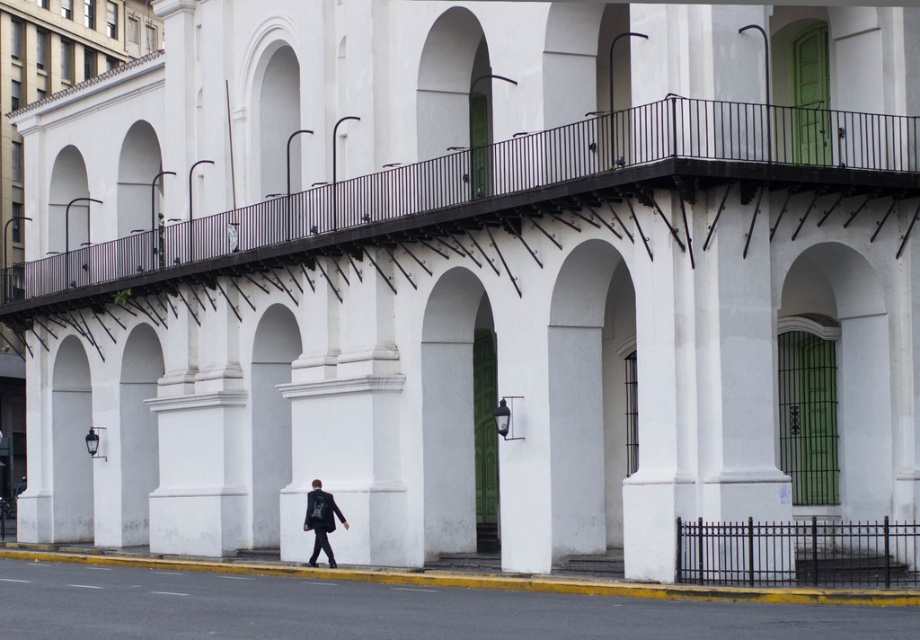
Question: Which of the following is the farthest from the observer?

Choices:
 (A) black metal railing at upper center
 (B) black metal fence at lower right

Answer: (A)

Question: Can you confirm if black metal fence at lower right is positioned above dark gray suit at center?

Choices:
 (A) yes
 (B) no

Answer: (A)

Question: Which of these objects is positioned closest to the black metal fence at lower right?

Choices:
 (A) dark gray suit at center
 (B) gray asphalt at lower center
 (C) black metal railing at upper center

Answer: (B)

Question: Does black metal fence at lower right have a smaller size compared to dark gray suit at center?

Choices:
 (A) yes
 (B) no

Answer: (B)

Question: Can you confirm if black metal railing at upper center is positioned above black metal fence at lower right?

Choices:
 (A) yes
 (B) no

Answer: (A)

Question: Which object is the closest to the dark gray suit at center?

Choices:
 (A) gray asphalt at lower center
 (B) black metal railing at upper center

Answer: (A)